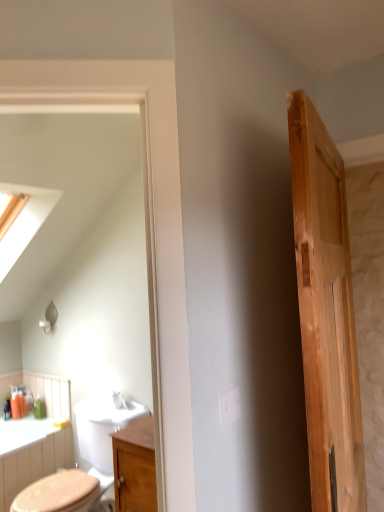
The width and height of the screenshot is (384, 512). Identify the location of natural wood door at right. (326, 313).

Image resolution: width=384 pixels, height=512 pixels. Describe the element at coordinates (326, 313) in the screenshot. I see `natural wood door at right` at that location.

What do you see at coordinates (135, 467) in the screenshot? Image resolution: width=384 pixels, height=512 pixels. I see `wooden cabinet at center` at bounding box center [135, 467].

What is the approximate width of wooden cabinet at center?

12.04 inches.

The height and width of the screenshot is (512, 384). Find the location of `wooden cabinet at center`. wooden cabinet at center is located at coordinates (135, 467).

Locate an element on the screen. natural wood door at right is located at coordinates (326, 313).

Consider the image. In the image, is natural wood door at right on the left side or the right side of wooden cabinet at center?

From the image, it's evident that natural wood door at right is to the right of wooden cabinet at center.

Is natural wood door at right in front of wooden cabinet at center?

Yes, it is in front of wooden cabinet at center.

Does point (342, 461) come closer to viewer compared to point (133, 454)?

Yes.

From the image's perspective, which object appears higher, natural wood door at right or wooden cabinet at center?

natural wood door at right.

From a real-world perspective, is natural wood door at right located beneath wooden cabinet at center?

No, from a real-world perspective, natural wood door at right is not under wooden cabinet at center.

Does natural wood door at right have a greater width compared to wooden cabinet at center?

No.

Considering the sizes of natural wood door at right and wooden cabinet at center in the image, is natural wood door at right taller or shorter than wooden cabinet at center?

Clearly, natural wood door at right is taller compared to wooden cabinet at center.

From the picture: Is natural wood door at right bigger than wooden cabinet at center?

Indeed, natural wood door at right has a larger size compared to wooden cabinet at center.

Is wooden cabinet at center a part of natural wood door at right?

No, wooden cabinet at center is located outside of natural wood door at right.

Is natural wood door at right far away from wooden cabinet at center?

No, natural wood door at right is in close proximity to wooden cabinet at center.

Is natural wood door at right facing towards wooden cabinet at center?

No, natural wood door at right is not turned towards wooden cabinet at center.

How many degrees apart are the facing directions of natural wood door at right and wooden cabinet at center?

They differ by 104 degrees in their facing directions.

This screenshot has width=384, height=512. Identify the location of bathroom cabinet behind the natural wood door at right. (135, 467).

Based on their positions, is wooden cabinet at center located to the left or right of natural wood door at right?

Clearly, wooden cabinet at center is on the left of natural wood door at right in the image.

Is the position of wooden cabinet at center less distant than that of natural wood door at right?

No, the depth of wooden cabinet at center is greater than that of natural wood door at right.

Is point (121, 483) closer to camera compared to point (340, 502)?

No.

From the image's perspective, which is above, wooden cabinet at center or natural wood door at right?

natural wood door at right appears higher in the image.

From a real-world perspective, between wooden cabinet at center and natural wood door at right, who is vertically lower?

In real-world perspective, wooden cabinet at center is lower.

Considering the sizes of objects wooden cabinet at center and natural wood door at right in the image provided, who is thinner, wooden cabinet at center or natural wood door at right?

natural wood door at right.

Is wooden cabinet at center taller than natural wood door at right?

No, wooden cabinet at center is not taller than natural wood door at right.

Who is bigger, wooden cabinet at center or natural wood door at right?

natural wood door at right.

Is wooden cabinet at center not within natural wood door at right?

Yes, wooden cabinet at center is located beyond the bounds of natural wood door at right.

Is wooden cabinet at center with natural wood door at right?

No.

Is wooden cabinet at center looking in the opposite direction of natural wood door at right?

No, wooden cabinet at center is not facing the opposite direction of natural wood door at right.

Identify the location of bathroom cabinet behind the natural wood door at right. This screenshot has width=384, height=512. (135, 467).

You are a GUI agent. You are given a task and a screenshot of the screen. Output one action in this format:
    pyautogui.click(x=<x>, y=<y>)
    Task: Click on the door on the right side of wooden cabinet at center
    The height and width of the screenshot is (512, 384).
    Given the screenshot: What is the action you would take?
    pyautogui.click(x=326, y=313)

Locate an element on the screen. The width and height of the screenshot is (384, 512). bathroom cabinet behind the natural wood door at right is located at coordinates (135, 467).